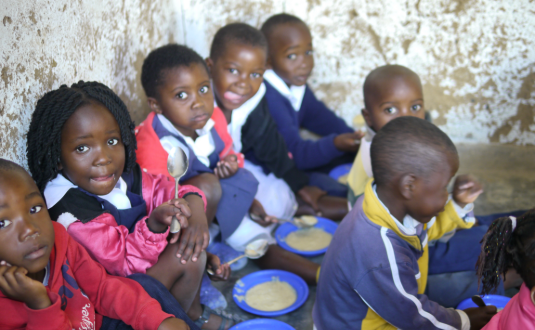
This screenshot has width=535, height=330. I want to click on walls, so click(114, 43), click(423, 33).